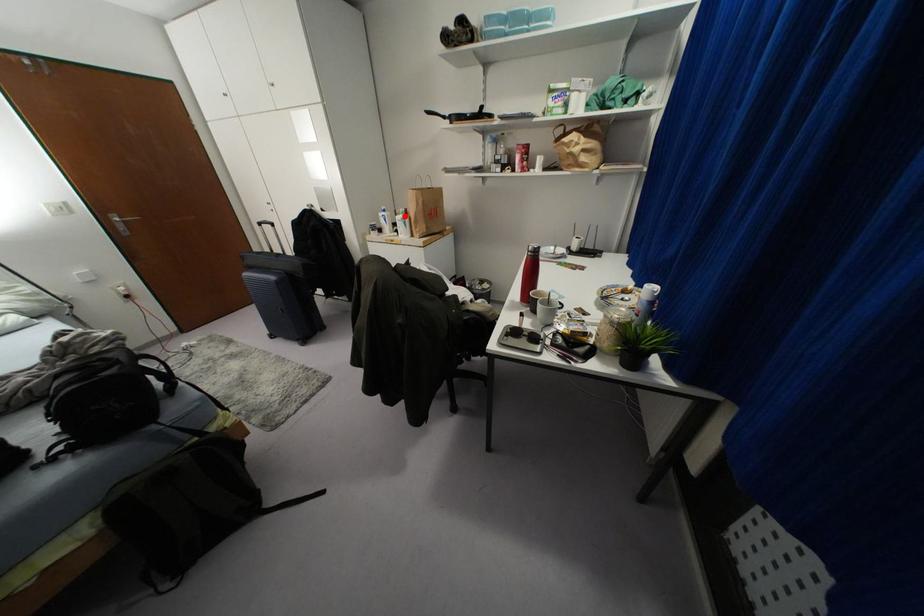
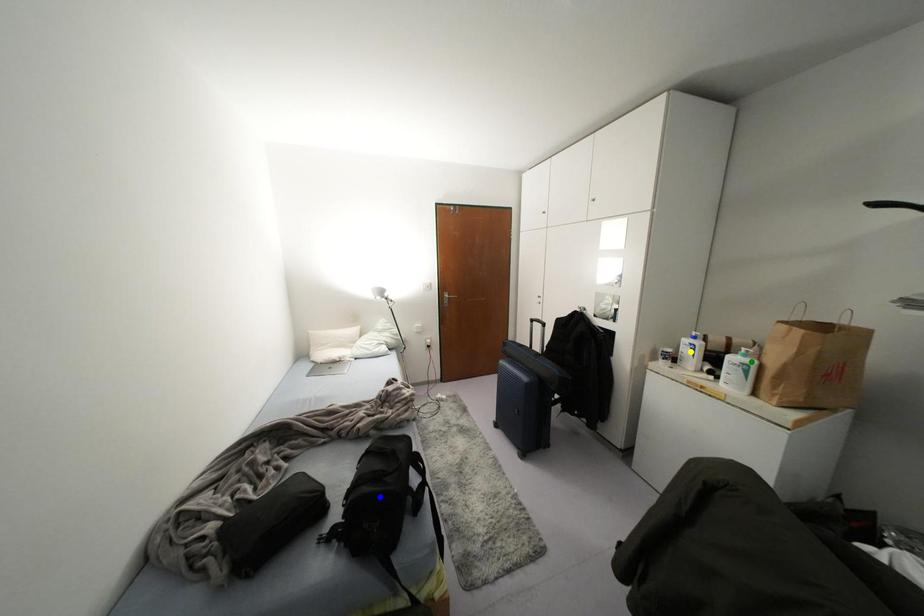
Question: I am providing you with two images of the same scene from different viewpoints. A red point is marked on the first image. You are given multiple points on the second image. Which spot in image 2 lines up with the point in image 1?

Choices:
 (A) green point
 (B) blue point
 (C) yellow point

Answer: (A)